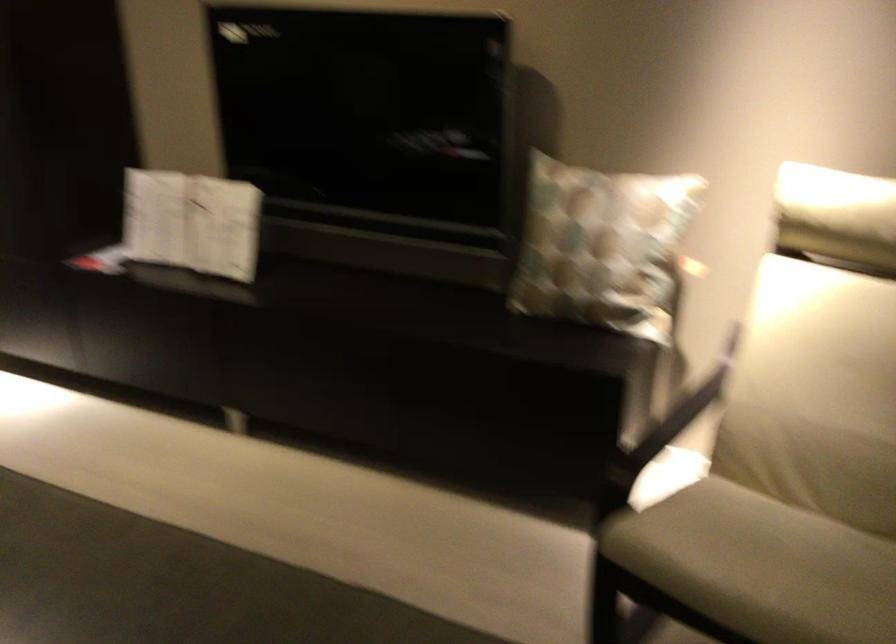
You are a GUI agent. You are given a task and a screenshot of the screen. Output one action in this format:
    pyautogui.click(x=<x>, y=<y>)
    Task: Click on the chair sitting surface
    
    Given the screenshot: What is the action you would take?
    pyautogui.click(x=765, y=567)